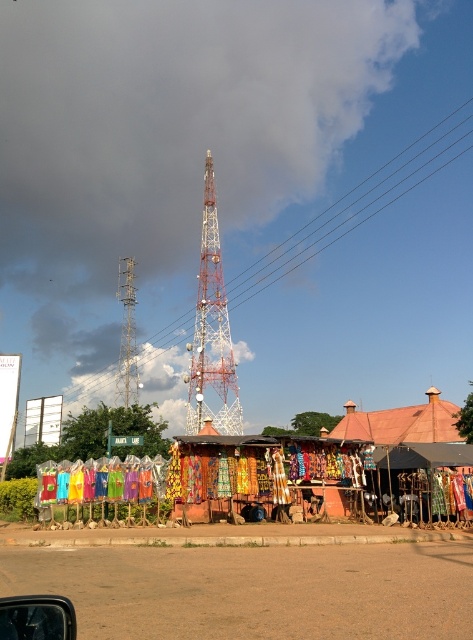
You are a photographer trying to capture the terracotta clay hut at lower right and the metallic silver tower at left in the same frame. Considering their widths, which object would you need to position closer to the camera to ensure both fit horizontally in the shot?

The terracotta clay hut at lower right has a lesser width compared to the metallic silver tower at left. To fit both in the frame, position the wider metallic silver tower at left closer to the camera so its larger size can be accommodated, while the narrower terracotta clay hut at lower right can be placed further back or adjusted accordingly.

You are sitting in a car parked near the roadside market stall. You want to see the terracotta clay hut at lower right without getting out of the car. Can you see it through the transparent glass car window at lower left?

The terracotta clay hut at lower right is further to the viewer than the transparent glass car window at lower left, so you can see it through the window.

You are a photographer wanting to capture both the metallic red tower at center and the metallic silver tower at left in the same frame. Based on their positions, which tower should you focus on to ensure both are visible without moving the camera?

You should focus on the metallic red tower at center because it is in front of the metallic silver tower at left, so positioning the camera to include the foreground tower will naturally include the background one as well.